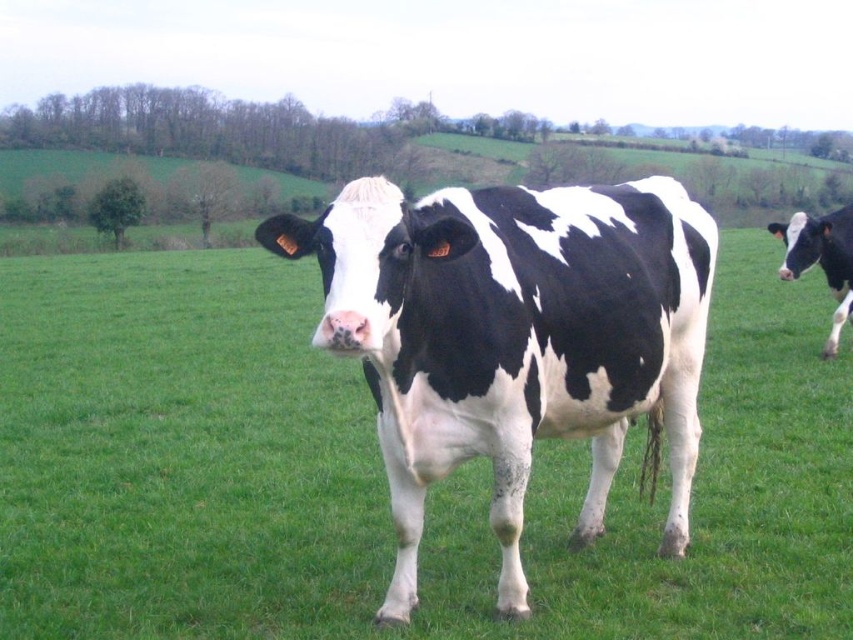
Where is `black and white spotted cow at center`? The height and width of the screenshot is (640, 853). black and white spotted cow at center is located at coordinates (514, 337).

Is point (567, 193) farther from camera compared to point (784, 273)?

No, it is in front of (784, 273).

Does point (399, 493) lie in front of point (807, 264)?

Yes, point (399, 493) is in front of point (807, 264).

Locate an element on the screen. Image resolution: width=853 pixels, height=640 pixels. black and white spotted cow at center is located at coordinates (514, 337).